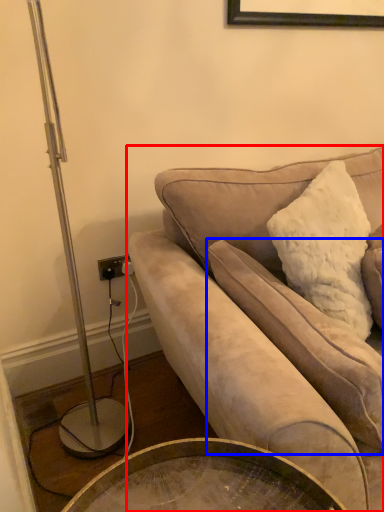
Question: Which object is closer to the camera taking this photo, studio couch (highlighted by a red box) or pillow (highlighted by a blue box)?

Choices:
 (A) studio couch
 (B) pillow

Answer: (A)